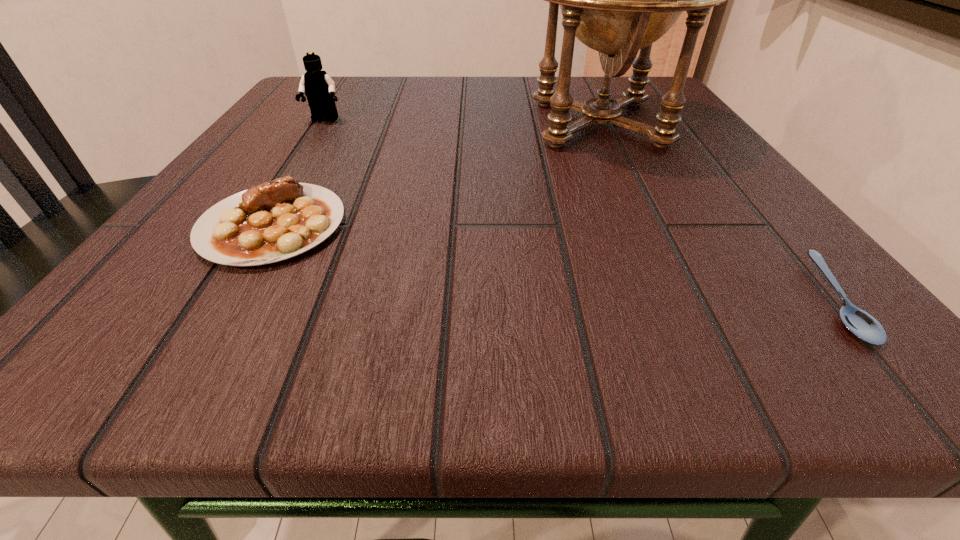
This screenshot has height=540, width=960. In order to click on vacant space that satisfies the following two spatial constraints: 1. on the front-facing side of the tallest object; 2. on the front side of the steak in this screenshot , I will do `click(649, 225)`.

Find the location of a particular element. The image size is (960, 540). free point that satisfies the following two spatial constraints: 1. on the back side of the soupspoon; 2. on the front-facing side of the globe is located at coordinates (685, 123).

The height and width of the screenshot is (540, 960). I want to click on vacant area in the image that satisfies the following two spatial constraints: 1. on the front-facing side of the soupspoon; 2. on the left side of the tallest object, so click(685, 300).